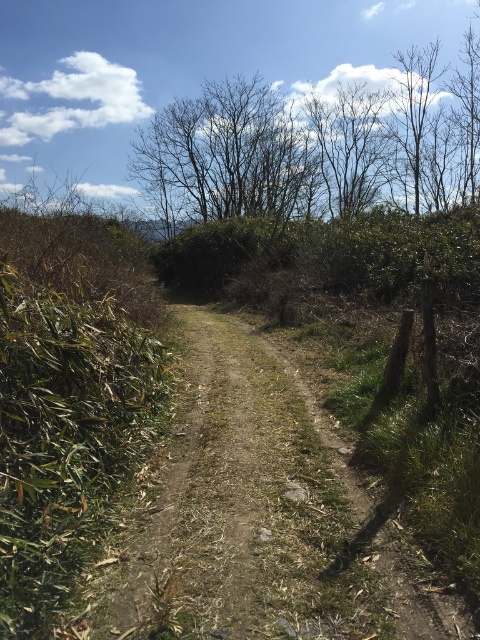
Does dull brown dirt track at center have a larger size compared to bare branches at upper center?

No, dull brown dirt track at center is not bigger than bare branches at upper center.

Which is in front, point (197, 518) or point (462, 112)?

Point (197, 518)

Find the location of a particular element. This screenshot has width=480, height=640. dull brown dirt track at center is located at coordinates (265, 516).